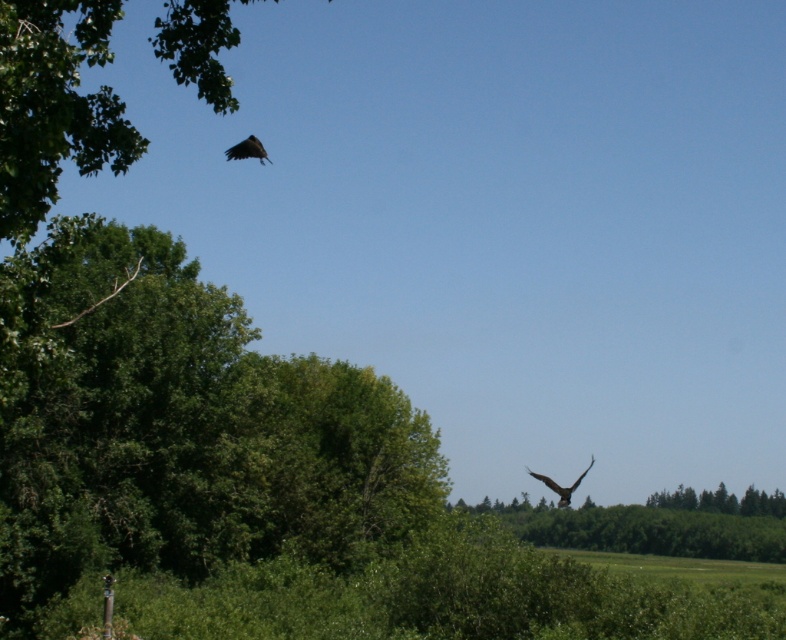
Question: Estimate the real-world distances between objects in this image. Which object is closer to the brown feathered eagle at lower right?

Choices:
 (A) dark brown eagle at upper left
 (B) green leafy tree at upper left

Answer: (B)

Question: Which object is farther from the camera taking this photo?

Choices:
 (A) green leafy tree at upper left
 (B) brown feathered eagle at lower right

Answer: (B)

Question: Can you confirm if green leafy tree at upper left is positioned to the right of dark brown eagle at upper left?

Choices:
 (A) yes
 (B) no

Answer: (B)

Question: Which point appears farthest from the camera in this image?

Choices:
 (A) (744, 508)
 (B) (570, 488)
 (C) (178, 42)

Answer: (A)

Question: Considering the relative positions of green leafy tree at lower right and dark brown eagle at upper left in the image provided, where is green leafy tree at lower right located with respect to dark brown eagle at upper left?

Choices:
 (A) left
 (B) right

Answer: (B)

Question: From the image, what is the correct spatial relationship of green leafy tree at upper left in relation to brown feathered eagle at lower right?

Choices:
 (A) right
 (B) left

Answer: (B)